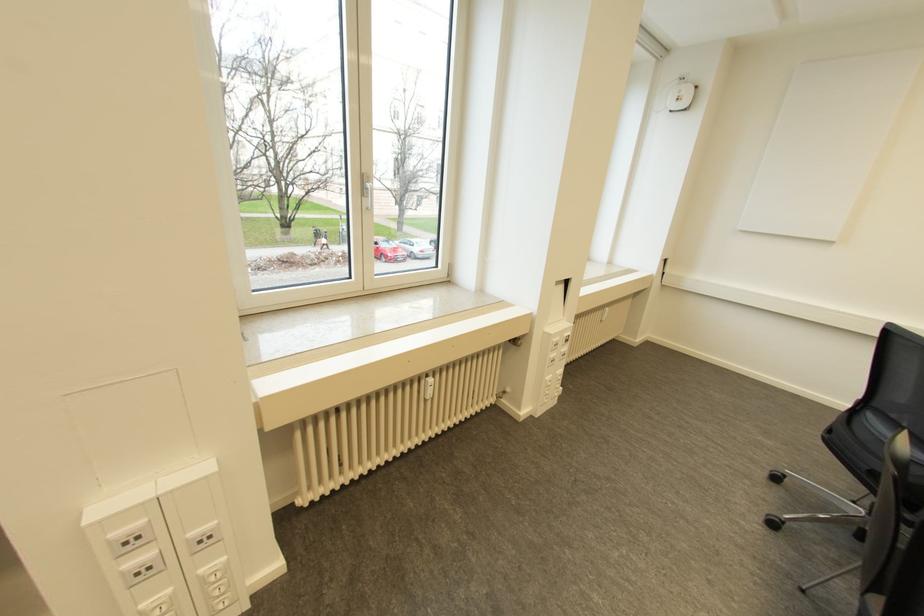
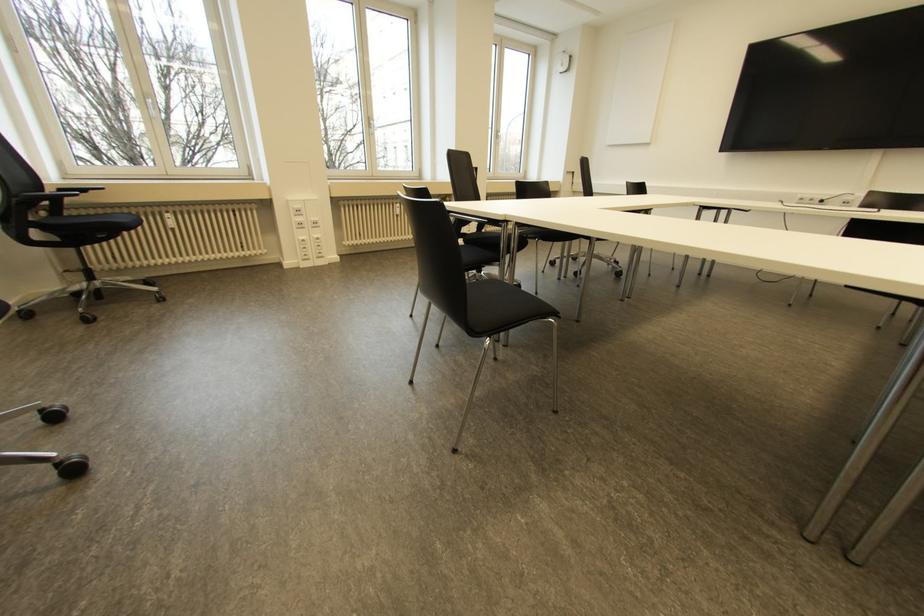
In the second image, find the point that corresponds to the point at 430,379 in the first image.

(397, 204)